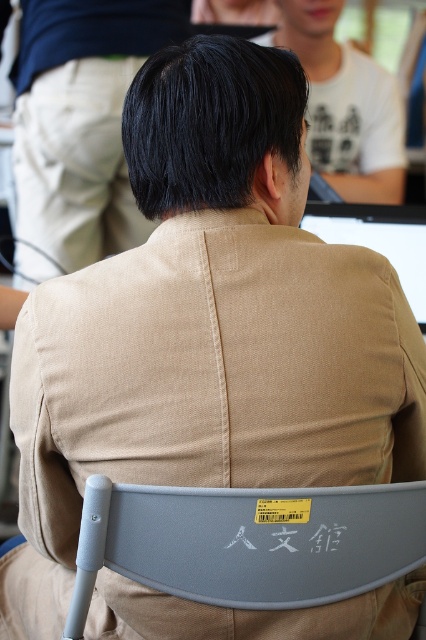
Question: Which point appears farthest from the camera in this image?

Choices:
 (A) (385, 100)
 (B) (161, 525)

Answer: (A)

Question: Is matte khaki shirt at upper center below matte black monitor at upper center?

Choices:
 (A) no
 (B) yes

Answer: (A)

Question: Can you confirm if matte black hair at upper center is positioned below matte black monitor at upper center?

Choices:
 (A) no
 (B) yes

Answer: (A)

Question: Which object is the farthest from the matte black hair at upper center?

Choices:
 (A) matte black monitor at upper center
 (B) gray plastic chair at lower center

Answer: (B)

Question: Can you confirm if matte black hair at upper center is positioned to the right of matte black monitor at upper center?

Choices:
 (A) yes
 (B) no

Answer: (B)

Question: Which of the following is the farthest from the observer?

Choices:
 (A) pyautogui.click(x=373, y=493)
 (B) pyautogui.click(x=77, y=106)
 (C) pyautogui.click(x=313, y=106)

Answer: (C)